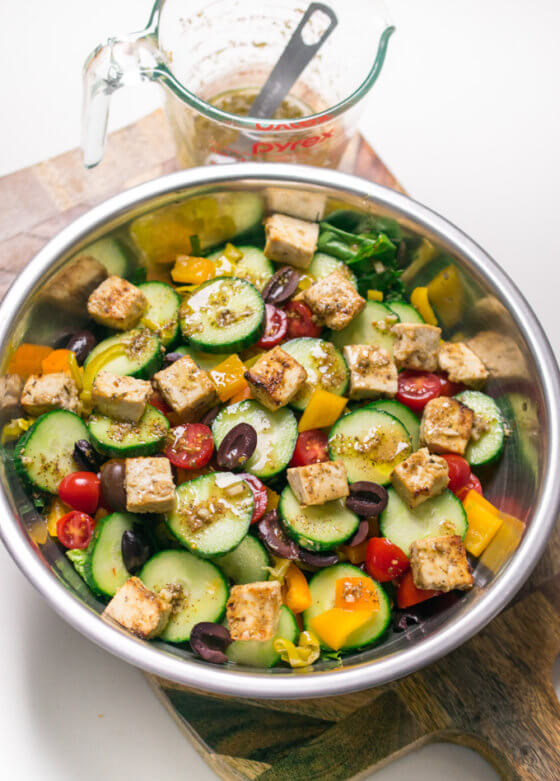
The image size is (560, 781). Identify the location of bright light source. (176, 173).